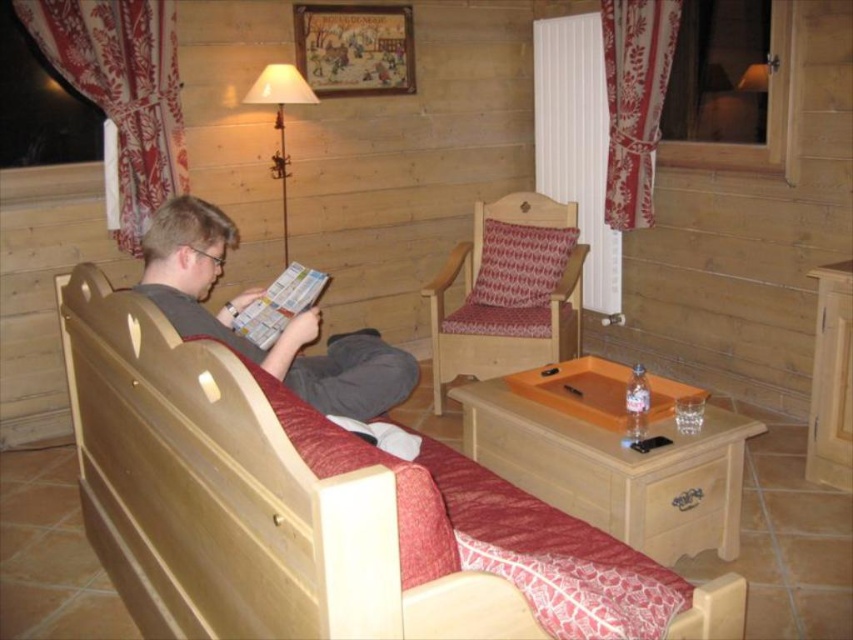
Question: Is wooden bed at center to the right of matte paper magazine at center from the viewer's perspective?

Choices:
 (A) yes
 (B) no

Answer: (B)

Question: Which of the following is the closest to the observer?

Choices:
 (A) (173, 310)
 (B) (305, 636)

Answer: (B)

Question: Which point is farther from the camera taking this photo?

Choices:
 (A) (247, 420)
 (B) (190, 221)
 (C) (260, 296)

Answer: (C)

Question: Based on their relative distances, which object is farther from the wooden armchair with patterned cushion at center?

Choices:
 (A) wooden bed at center
 (B) matte gray shirt at left
 (C) matte paper magazine at center
 (D) matte metal lamp at upper center

Answer: (A)

Question: Is wooden armchair with patterned cushion at center positioned behind matte paper magazine at center?

Choices:
 (A) yes
 (B) no

Answer: (A)

Question: Observing the image, what is the correct spatial positioning of wooden bed at center in reference to matte metal lamp at upper center?

Choices:
 (A) below
 (B) above

Answer: (A)